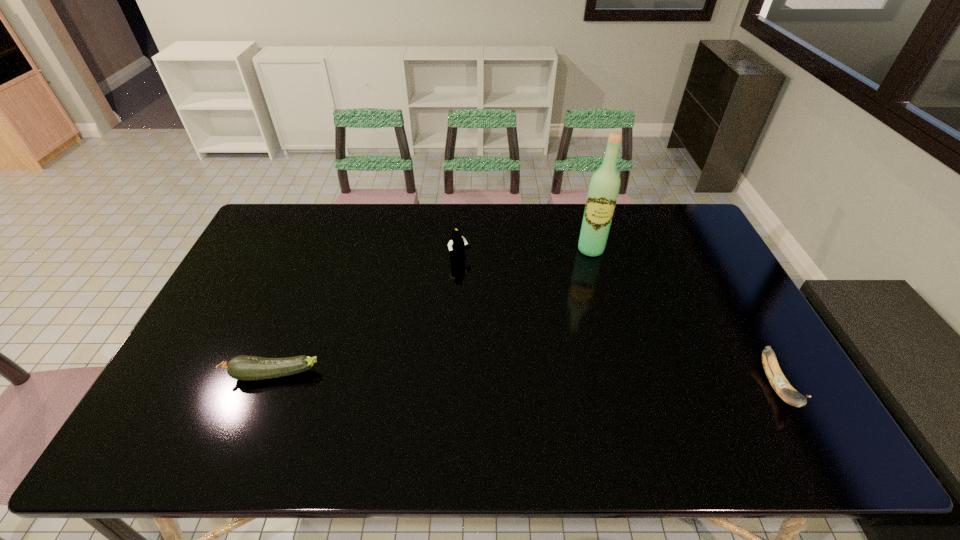
This screenshot has width=960, height=540. I want to click on object that is at the right edge, so click(x=778, y=381).

Image resolution: width=960 pixels, height=540 pixels. Find the location of `object that is at the near left corner`. object that is at the near left corner is located at coordinates (247, 368).

The height and width of the screenshot is (540, 960). What are the coordinates of `object that is at the near right corner` in the screenshot? It's located at (778, 381).

Locate an element on the screen. Image resolution: width=960 pixels, height=540 pixels. vacant space at the far edge of the desktop is located at coordinates (405, 214).

This screenshot has height=540, width=960. Identify the location of blank space at the near edge of the desktop. (547, 383).

In the image, there is a desktop. Where is `blank space at the left edge`? This screenshot has width=960, height=540. blank space at the left edge is located at coordinates (216, 303).

The width and height of the screenshot is (960, 540). In the image, there is a desktop. In order to click on vacant space at the right edge in this screenshot , I will do `click(691, 259)`.

Image resolution: width=960 pixels, height=540 pixels. What are the coordinates of `vacant region at the far left corner of the desktop` in the screenshot? It's located at (297, 208).

The height and width of the screenshot is (540, 960). What are the coordinates of `free space at the near left corner` in the screenshot? It's located at (212, 400).

Locate an element on the screen. This screenshot has height=540, width=960. free space that is in between the zucchini and the banana is located at coordinates (524, 380).